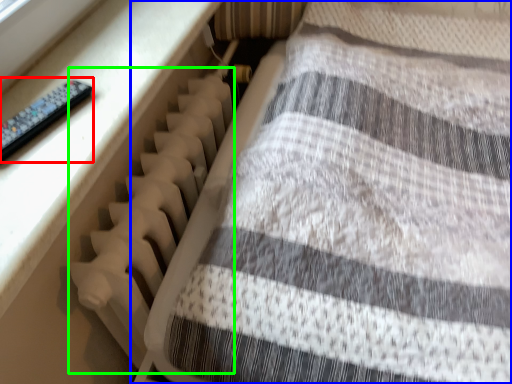
Question: Based on their relative distances, which object is nearer to control (highlighted by a red box)? Choose from furniture (highlighted by a blue box) and radiator (highlighted by a green box).

Choices:
 (A) furniture
 (B) radiator

Answer: (B)